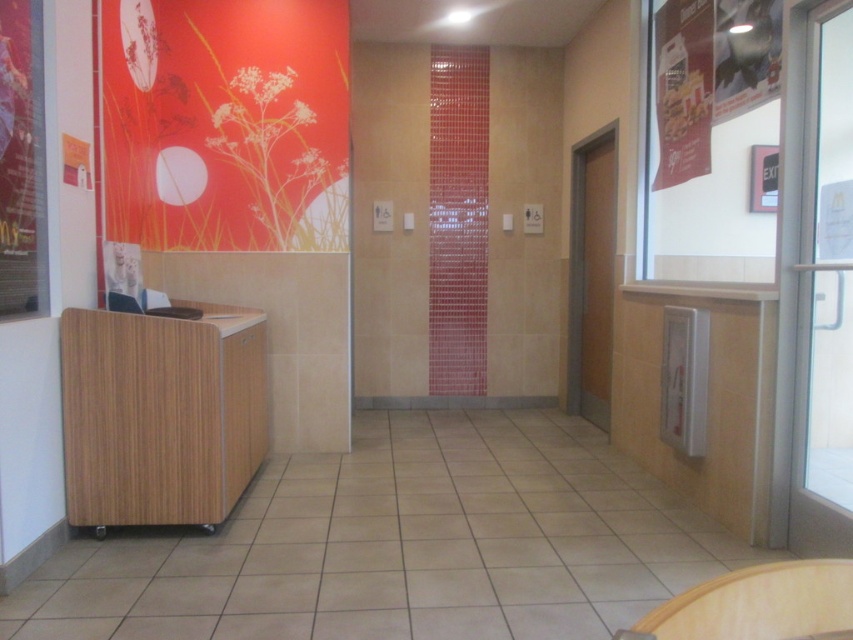
You are a customer in the restaurant and want to read both the metallic gold poster at upper right and the matte paper poster at upper right. How far apart are these two posters?

The metallic gold poster at upper right and the matte paper poster at upper right are 13.05 inches apart.

You are a customer entering the restaurant and see the matte paper poster at left and the wooden chair at left. Which object is closer to the entrance?

The matte paper poster at left is to the left of the wooden chair at left, so the poster is closer to the entrance.

You are a customer entering the restaurant and need to read the matte paper poster at left and sit on the wooden chair at lower right. Which object will you encounter first as you walk towards them?

The wooden chair at lower right will be encountered first because it is positioned closer to the entrance where the customer is entering, while the matte paper poster at left is placed further back.